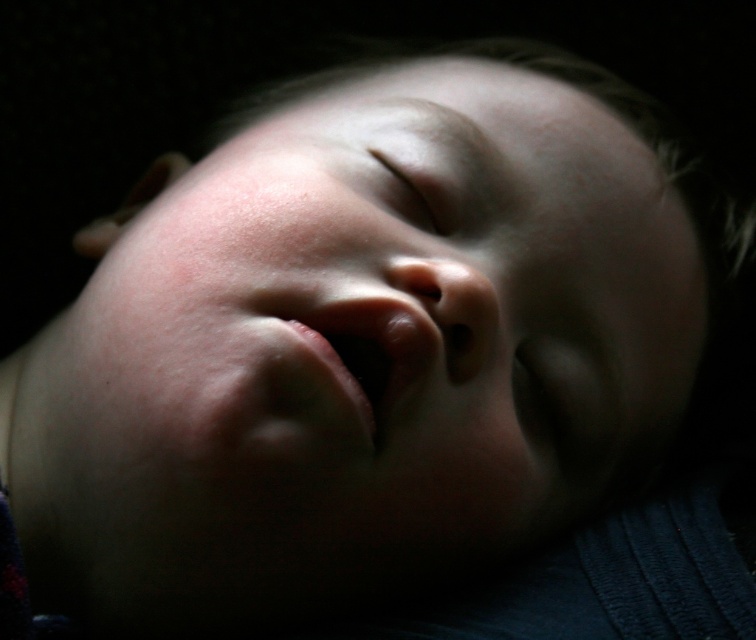
Does point (394, 372) come closer to viewer compared to point (411, 196)?

Yes.

Consider the image. Who is lower down, pink smooth lips at center or smooth skin at center?

pink smooth lips at center is lower down.

Between point (346, 305) and point (448, 148), which one is positioned behind?

The point (448, 148) is behind.

You are a GUI agent. You are given a task and a screenshot of the screen. Output one action in this format:
    pyautogui.click(x=<x>, y=<y>)
    Task: Click on the pink smooth lips at center
    This screenshot has height=640, width=756.
    Given the screenshot: What is the action you would take?
    pyautogui.click(x=363, y=348)

Does smooth skin face at center have a lesser width compared to smooth skin at center?

Incorrect, smooth skin face at center's width is not less than smooth skin at center's.

Can you confirm if smooth skin face at center is positioned to the left of smooth skin at center?

Correct, you'll find smooth skin face at center to the left of smooth skin at center.

Between point (600, 374) and point (369, 156), which one is positioned in front?

Positioned in front is point (600, 374).

Find the location of a particular element. smooth skin face at center is located at coordinates (386, 332).

Who is higher up, smooth skin face at center or pink smooth lips at center?

smooth skin face at center is above.

Between smooth skin face at center and pink smooth lips at center, which one has less height?

pink smooth lips at center is shorter.

In order to click on smooth skin face at center in this screenshot , I will do `click(386, 332)`.

In order to click on smooth skin face at center in this screenshot , I will do `click(386, 332)`.